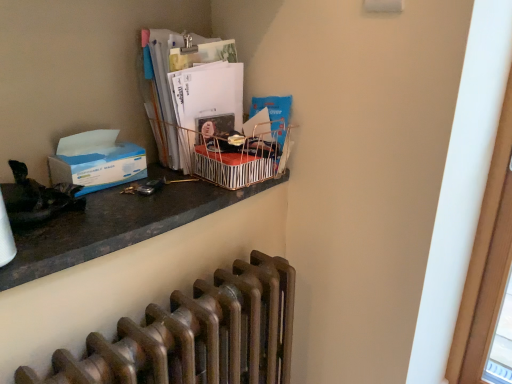
Image resolution: width=512 pixels, height=384 pixels. What are the coordinates of `vacant space in front of matte paper magazine at upper center` in the screenshot? It's located at (168, 187).